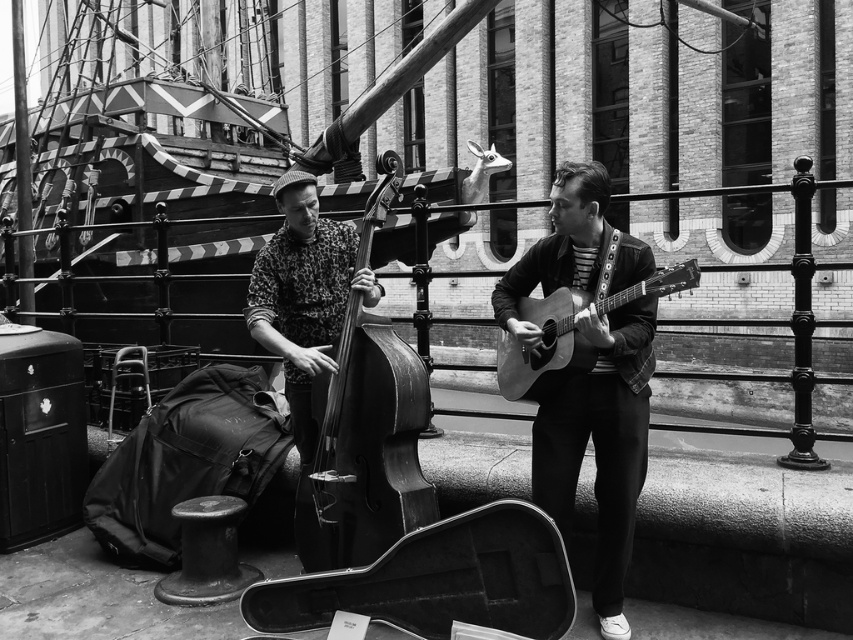
Who is more forward, [587,168] or [401,496]?

Positioned in front is point [587,168].

Does smooth wood guitar at center have a smaller size compared to wooden polished cello at center?

Actually, smooth wood guitar at center might be larger than wooden polished cello at center.

Locate an element on the screen. The width and height of the screenshot is (853, 640). smooth wood guitar at center is located at coordinates tap(601, 444).

Does wooden polished cello at center have a smaller size compared to printed fabric bass at center?

No.

Which of these two, wooden polished cello at center or printed fabric bass at center, stands shorter?

With less height is printed fabric bass at center.

Identify the location of wooden polished cello at center. The height and width of the screenshot is (640, 853). (364, 449).

Which is more to the left, smooth wood guitar at center or acoustic wood guitar at right?

smooth wood guitar at center

At what (x,y) coordinates should I click in order to perform the action: click on smooth wood guitar at center. Please return your answer as a coordinate pair (x, y). Image resolution: width=853 pixels, height=640 pixels. Looking at the image, I should click on (601, 444).

Is point (639, 416) positioned behind point (572, 353)?

Yes, point (639, 416) is behind point (572, 353).

Find the location of a particular element. smooth wood guitar at center is located at coordinates (601, 444).